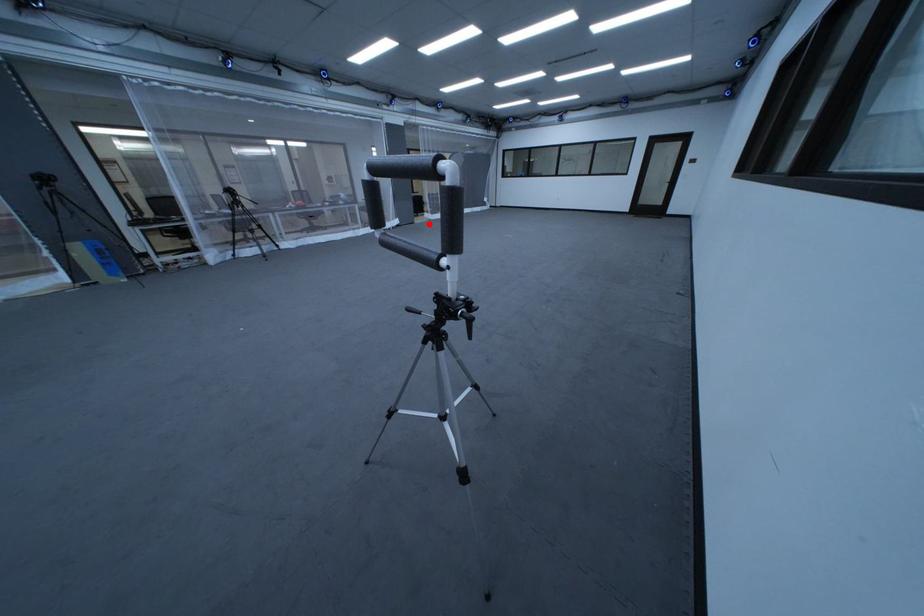
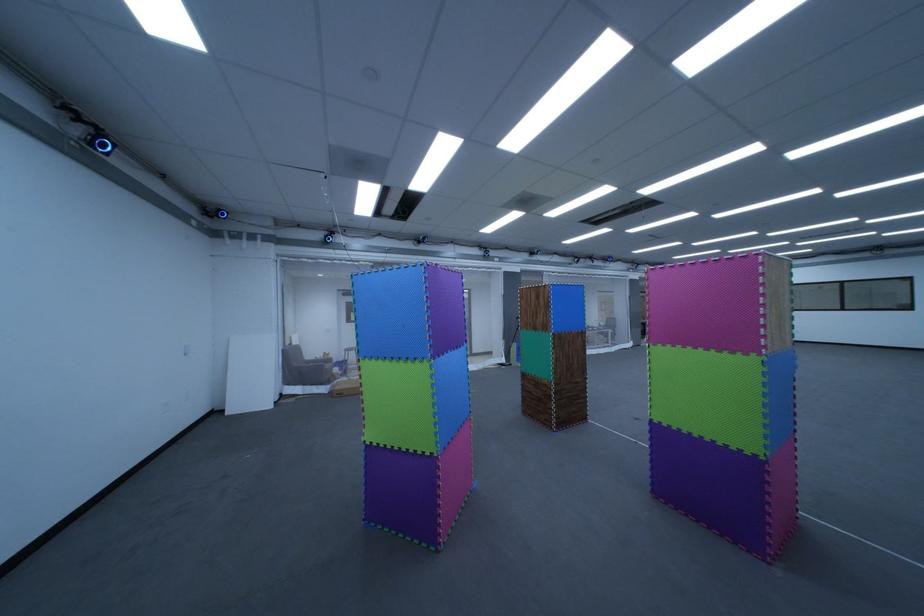
The point at the highlighted location is marked in the first image. Where is the corresponding point in the second image?

(655, 346)